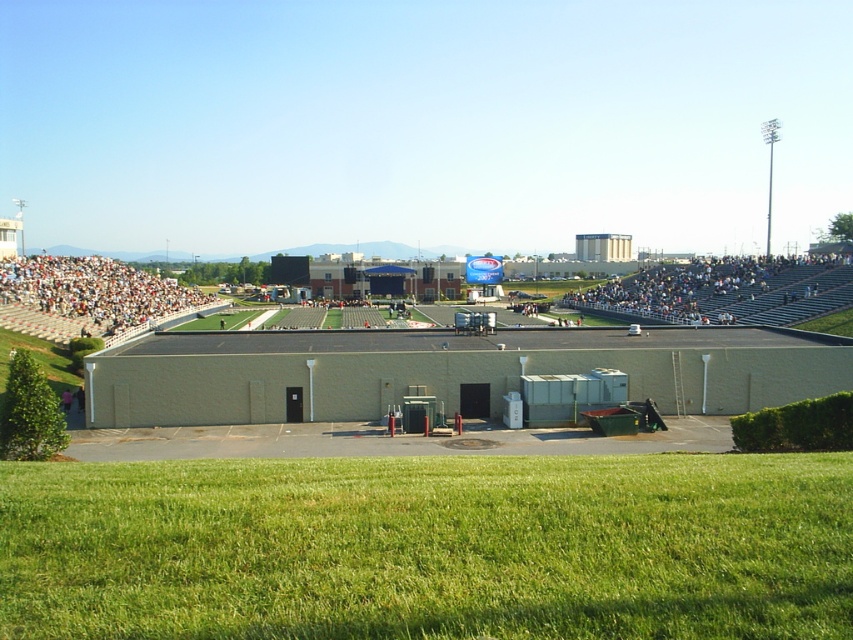
Does gray metallic bleachers at right appear under white plastic seats at left?

Actually, gray metallic bleachers at right is above white plastic seats at left.

Is point (720, 266) farther from viewer compared to point (64, 316)?

Yes, point (720, 266) is farther from viewer.

The width and height of the screenshot is (853, 640). What are the coordinates of `gray metallic bleachers at right` in the screenshot? It's located at (724, 291).

Between green grass at lower center and gray metallic bleachers at right, which one is positioned lower?

green grass at lower center is lower down.

Who is more forward, (231, 492) or (728, 276)?

Point (231, 492)

At what (x,y) coordinates should I click in order to perform the action: click on green grass at lower center. Please return your answer as a coordinate pair (x, y). This screenshot has width=853, height=640. Looking at the image, I should click on (428, 547).

Can you confirm if green grass at lower center is smaller than white plastic seats at left?

Indeed, green grass at lower center has a smaller size compared to white plastic seats at left.

Between green grass at lower center and white plastic seats at left, which one is positioned lower?

green grass at lower center is below.

Who is more forward, (376, 548) or (106, 310)?

Positioned in front is point (376, 548).

This screenshot has width=853, height=640. I want to click on green grass at lower center, so [428, 547].